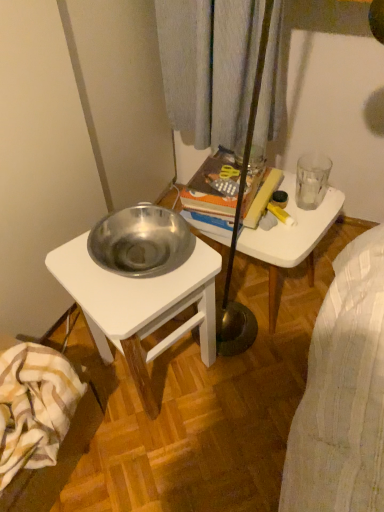
Find the location of a particular element. empty space that is to the right of polished silver bowl at left is located at coordinates (252, 383).